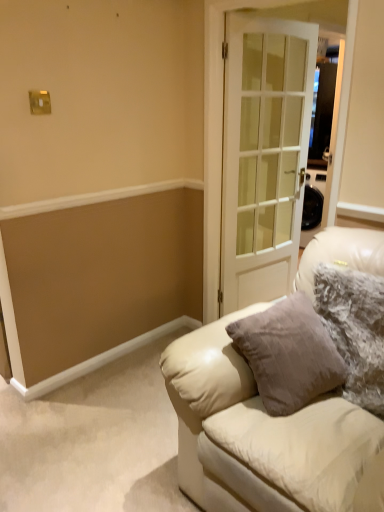
Question: Is the depth of fuzzy fabric pillow at right greater than that of white glass door at center?

Choices:
 (A) no
 (B) yes

Answer: (A)

Question: Are fuzzy fabric pillow at right and white glass door at center located far from each other?

Choices:
 (A) yes
 (B) no

Answer: (A)

Question: Is the surface of fuzzy fabric pillow at right in direct contact with white glass door at center?

Choices:
 (A) no
 (B) yes

Answer: (A)

Question: Can you confirm if fuzzy fabric pillow at right is taller than white glass door at center?

Choices:
 (A) yes
 (B) no

Answer: (B)

Question: From the image's perspective, is fuzzy fabric pillow at right on white glass door at center?

Choices:
 (A) no
 (B) yes

Answer: (A)

Question: Would you say fuzzy fabric pillow at right is outside white glass door at center?

Choices:
 (A) yes
 (B) no

Answer: (A)

Question: Is fuzzy fabric pillow at right behind leather couch at center?

Choices:
 (A) yes
 (B) no

Answer: (A)

Question: Is fuzzy fabric pillow at right surrounding leather couch at center?

Choices:
 (A) yes
 (B) no

Answer: (B)

Question: From the image's perspective, is fuzzy fabric pillow at right located above leather couch at center?

Choices:
 (A) yes
 (B) no

Answer: (A)

Question: Is fuzzy fabric pillow at right outside leather couch at center?

Choices:
 (A) yes
 (B) no

Answer: (B)

Question: Is fuzzy fabric pillow at right turned away from leather couch at center?

Choices:
 (A) no
 (B) yes

Answer: (B)

Question: From a real-world perspective, does fuzzy fabric pillow at right stand above leather couch at center?

Choices:
 (A) no
 (B) yes

Answer: (B)

Question: From the image's perspective, does leather couch at center appear higher than white glass door at center?

Choices:
 (A) no
 (B) yes

Answer: (A)